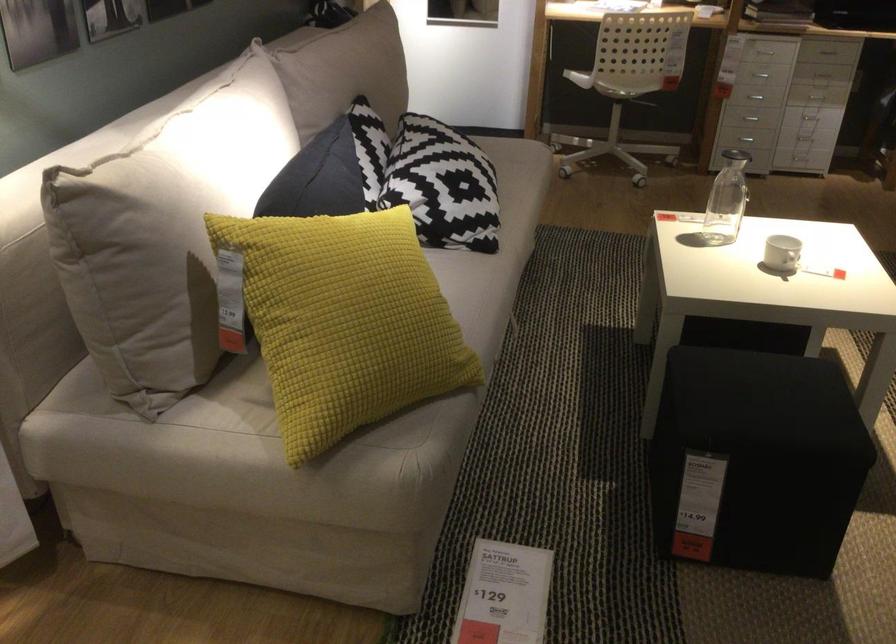
I want to click on black ottoman, so click(755, 460).